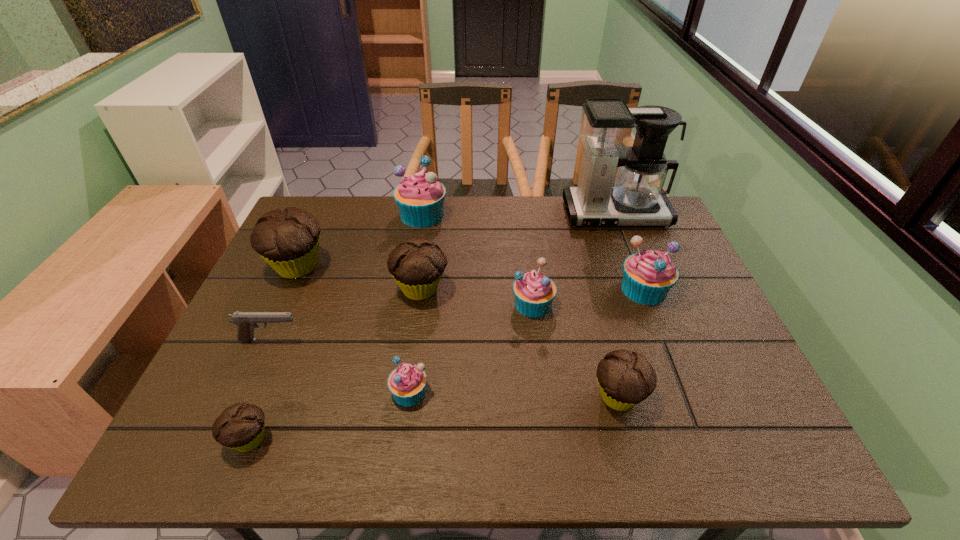
Where is `free space between the gray coffee maker and the second chocolate muffin from right to left`? The height and width of the screenshot is (540, 960). free space between the gray coffee maker and the second chocolate muffin from right to left is located at coordinates (517, 252).

At what (x,y) coordinates should I click in order to perform the action: click on vacant area between the biggest chocolate muffin and the smallest chocolate muffin. Please return your answer as a coordinate pair (x, y). The height and width of the screenshot is (540, 960). Looking at the image, I should click on (274, 353).

The height and width of the screenshot is (540, 960). Find the location of `empty space that is in between the pistol and the smallest chocolate muffin`. empty space that is in between the pistol and the smallest chocolate muffin is located at coordinates (260, 389).

This screenshot has width=960, height=540. In order to click on free space between the smallest blue muffin and the biggest chocolate muffin in this screenshot , I will do `click(353, 329)`.

I want to click on free space between the seventh farthest object and the rightmost chocolate muffin, so click(444, 368).

Image resolution: width=960 pixels, height=540 pixels. I want to click on unoccupied area between the biggest chocolate muffin and the rightmost chocolate muffin, so click(458, 332).

Where is `object identified as the eighth closest to the smallest chocolate muffin`? object identified as the eighth closest to the smallest chocolate muffin is located at coordinates (648, 276).

Select which object is the ninth closest to the biggest chocolate muffin. Please provide its 2D coordinates. Your answer should be formatted as a tuple, i.e. [(x, y)], where the tuple contains the x and y coordinates of a point satisfying the conditions above.

[(648, 276)]

Where is `muffin that is the closest to the rightmost chocolate muffin`? Image resolution: width=960 pixels, height=540 pixels. muffin that is the closest to the rightmost chocolate muffin is located at coordinates (534, 292).

Select which muffin appears as the seventh closest to the second chocolate muffin from right to left. Please provide its 2D coordinates. Your answer should be formatted as a tuple, i.e. [(x, y)], where the tuple contains the x and y coordinates of a point satisfying the conditions above.

[(648, 276)]